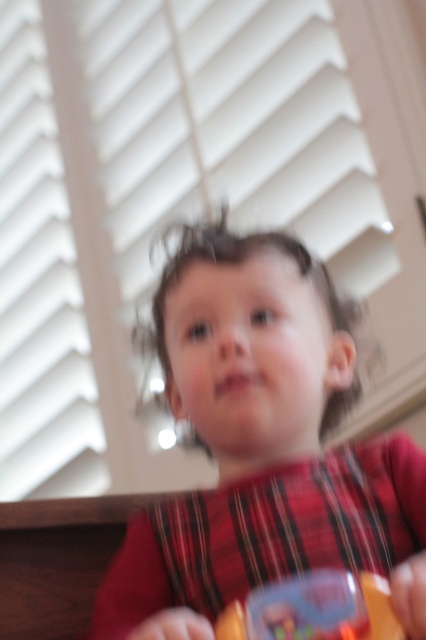
Who is higher up, white matte blinds at upper center or matte red shirt at center?

white matte blinds at upper center is higher up.

Does point (344, 256) come in front of point (311, 536)?

No, (344, 256) is further to viewer.

Locate an element on the screen. This screenshot has width=426, height=640. white matte blinds at upper center is located at coordinates (152, 200).

Who is taller, matte red shirt at center or translucent plastic toy at lower center?

With more height is matte red shirt at center.

Between point (288, 260) and point (371, 632), which one is positioned behind?

The point (288, 260) is more distant.

Is point (204, 632) positioned behind point (316, 582)?

That is False.

Locate an element on the screen. matte red shirt at center is located at coordinates [261, 445].

Can you confirm if white matte blinds at upper center is smaller than translucent plastic toy at lower center?

Actually, white matte blinds at upper center might be larger than translucent plastic toy at lower center.

Can you confirm if white matte blinds at upper center is bigger than translucent plastic toy at lower center?

Yes, white matte blinds at upper center is bigger than translucent plastic toy at lower center.

Is point (17, 36) more distant than point (296, 596)?

Yes, point (17, 36) is behind point (296, 596).

What are the coordinates of `white matte blinds at upper center` in the screenshot? It's located at point(152,200).